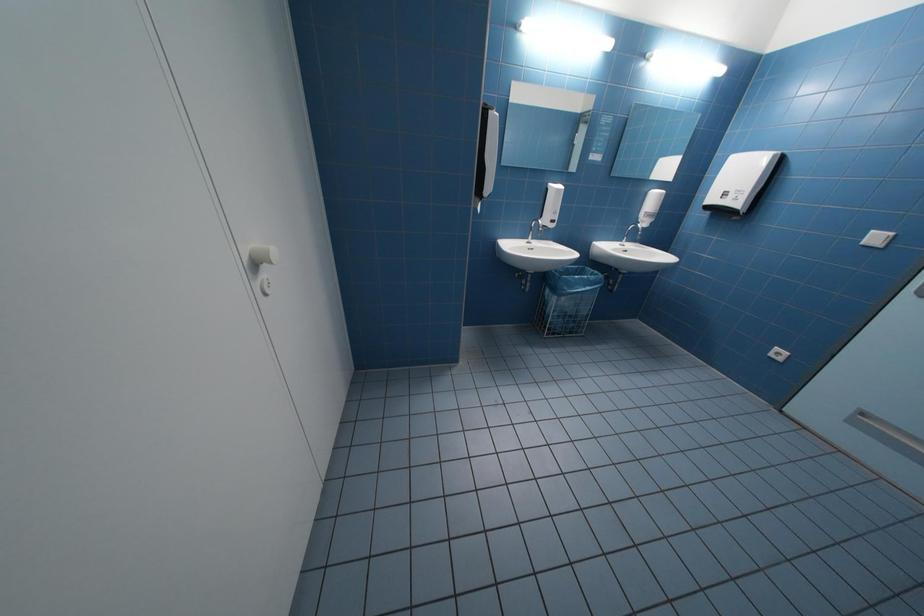
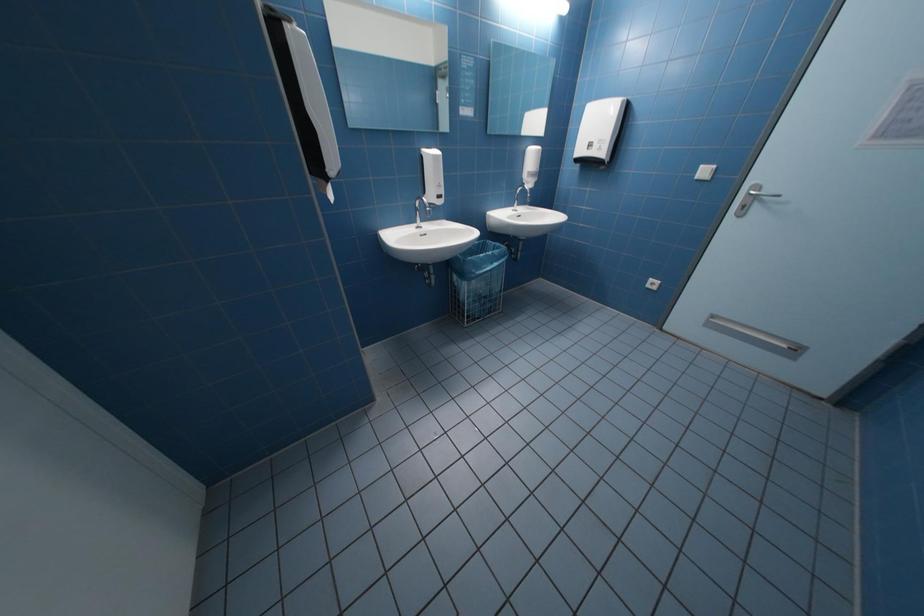
Question: How did the camera likely rotate?

Choices:
 (A) Left
 (B) Right
 (C) Up
 (D) Down

Answer: (B)